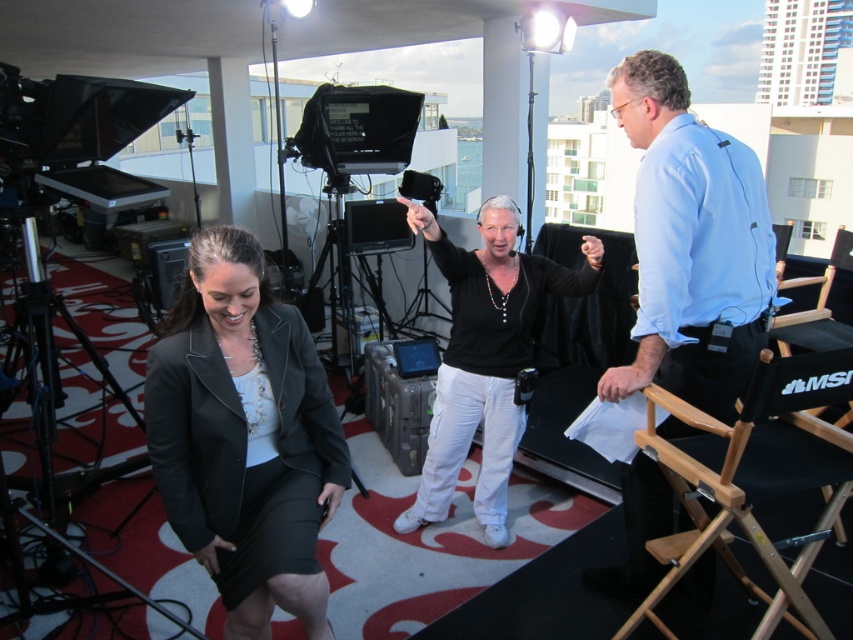
Can you confirm if blue shirt at right is positioned to the right of black matte shirt at center?

Indeed, blue shirt at right is positioned on the right side of black matte shirt at center.

Can you confirm if blue shirt at right is smaller than black matte shirt at center?

Correct, blue shirt at right occupies less space than black matte shirt at center.

What do you see at coordinates (691, 244) in the screenshot? Image resolution: width=853 pixels, height=640 pixels. I see `blue shirt at right` at bounding box center [691, 244].

At what (x,y) coordinates should I click in order to perform the action: click on blue shirt at right. Please return your answer as a coordinate pair (x, y). This screenshot has width=853, height=640. Looking at the image, I should click on (691, 244).

Is matte black blazer at center below blue shirt at right?

Yes, matte black blazer at center is below blue shirt at right.

Is matte black blazer at center wider than blue shirt at right?

In fact, matte black blazer at center might be narrower than blue shirt at right.

Who is more forward, (196, 499) or (758, 224)?

Positioned in front is point (196, 499).

The image size is (853, 640). What are the coordinates of `matte black blazer at center` in the screenshot? It's located at (244, 436).

Does matte black blazer at center lie in front of black matte shirt at center?

Yes, it is in front of black matte shirt at center.

Is matte black blazer at center above black matte shirt at center?

No.

You are a GUI agent. You are given a task and a screenshot of the screen. Output one action in this format:
    pyautogui.click(x=<x>, y=<y>)
    Task: Click on the matte black blazer at center
    This screenshot has height=640, width=853.
    Given the screenshot: What is the action you would take?
    pyautogui.click(x=244, y=436)